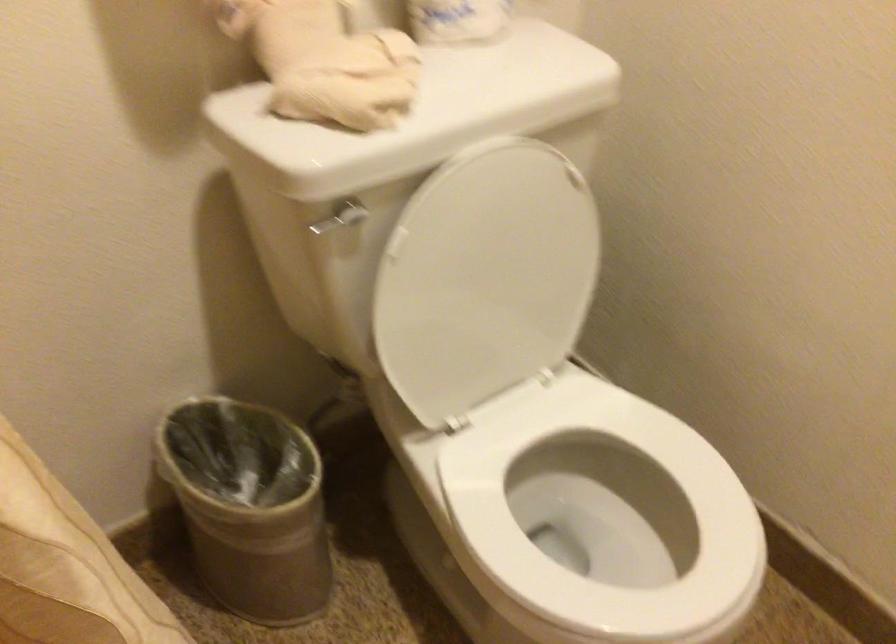
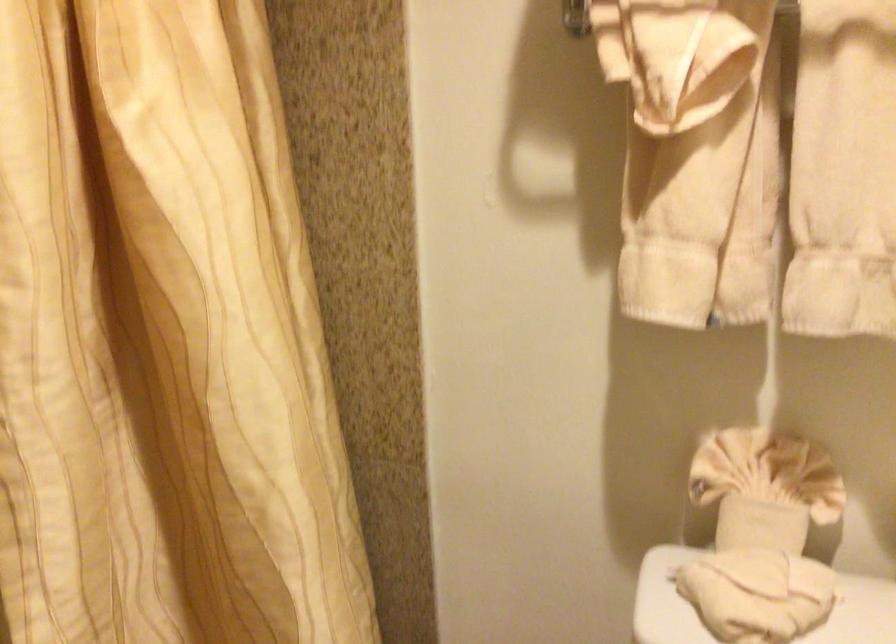
Question: The first image is from the beginning of the video and the second image is from the end. How did the camera likely rotate when shooting the video?

Choices:
 (A) Left
 (B) Right
 (C) Up
 (D) Down

Answer: (A)